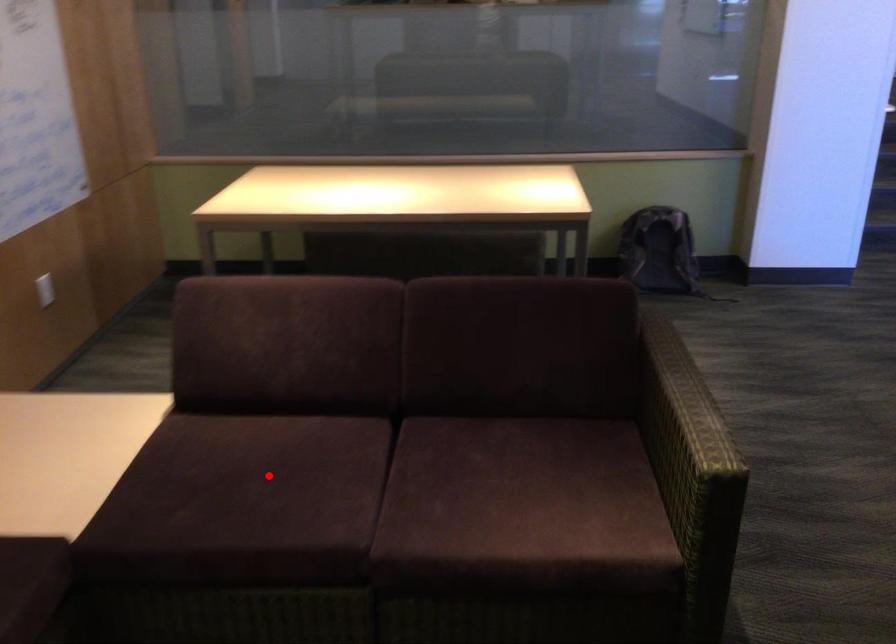
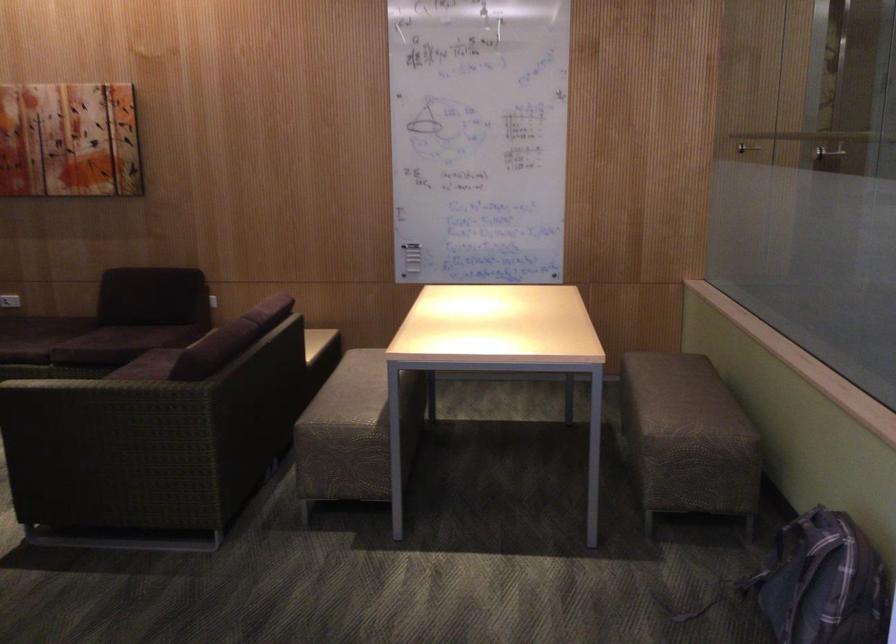
Question: I am providing you with two images of the same scene from different viewpoints. A red point is marked on the first image. Can you still see the location of the red point in image 2?

Choices:
 (A) Yes
 (B) No

Answer: (B)